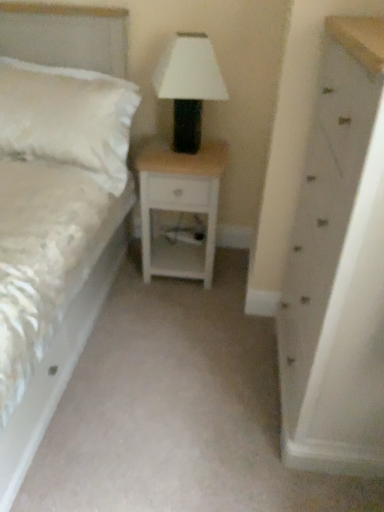
Where is `blank space to the left of white painted wood chest of drawers at right`? The width and height of the screenshot is (384, 512). blank space to the left of white painted wood chest of drawers at right is located at coordinates (204, 380).